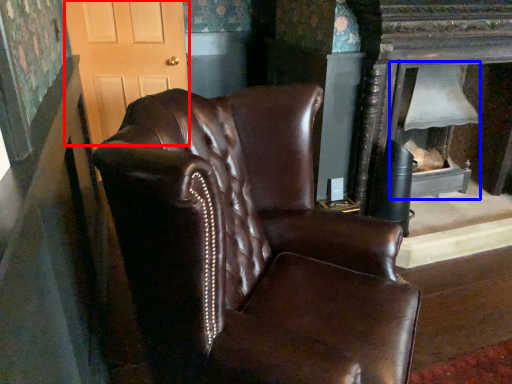
Question: Among these objects, which one is farthest to the camera, glass door (highlighted by a red box) or fireplace (highlighted by a blue box)?

Choices:
 (A) glass door
 (B) fireplace

Answer: (A)